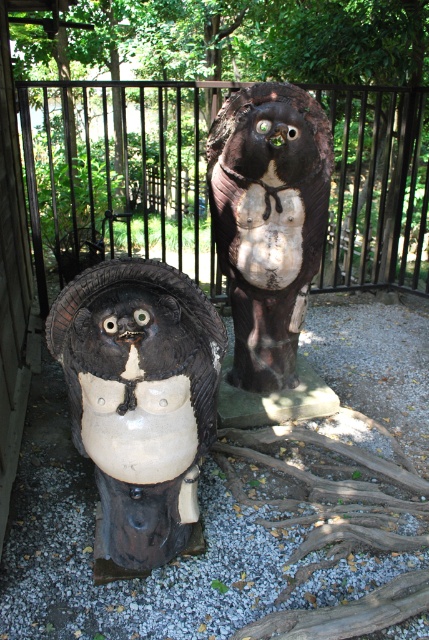
Question: Which object is positioned closest to the matte black owl at center?

Choices:
 (A) black metal fence at upper center
 (B) wooden owl at center

Answer: (B)

Question: Estimate the real-world distances between objects in this image. Which object is closer to the wooden owl at center?

Choices:
 (A) black metal fence at upper center
 (B) matte black owl at center

Answer: (B)

Question: Which object is positioned closest to the black metal fence at upper center?

Choices:
 (A) wooden owl at center
 (B) matte black owl at center

Answer: (B)

Question: Observing the image, what is the correct spatial positioning of wooden owl at center in reference to matte black owl at center?

Choices:
 (A) below
 (B) above

Answer: (A)

Question: Does black metal fence at upper center appear on the left side of matte black owl at center?

Choices:
 (A) yes
 (B) no

Answer: (A)

Question: Observing the image, what is the correct spatial positioning of black metal fence at upper center in reference to matte black owl at center?

Choices:
 (A) below
 (B) above

Answer: (B)